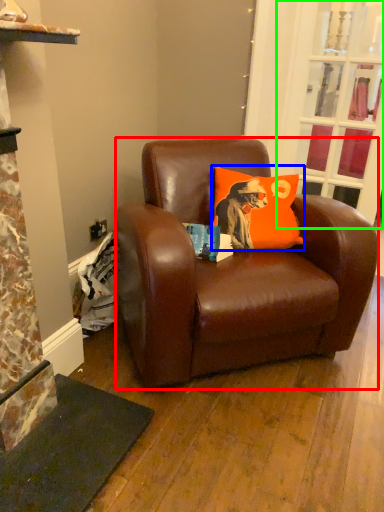
Question: Which object is the closest to the studio couch (highlighted by a red box)? Choose among these: pillow (highlighted by a blue box) or glass door (highlighted by a green box).

Choices:
 (A) pillow
 (B) glass door

Answer: (A)